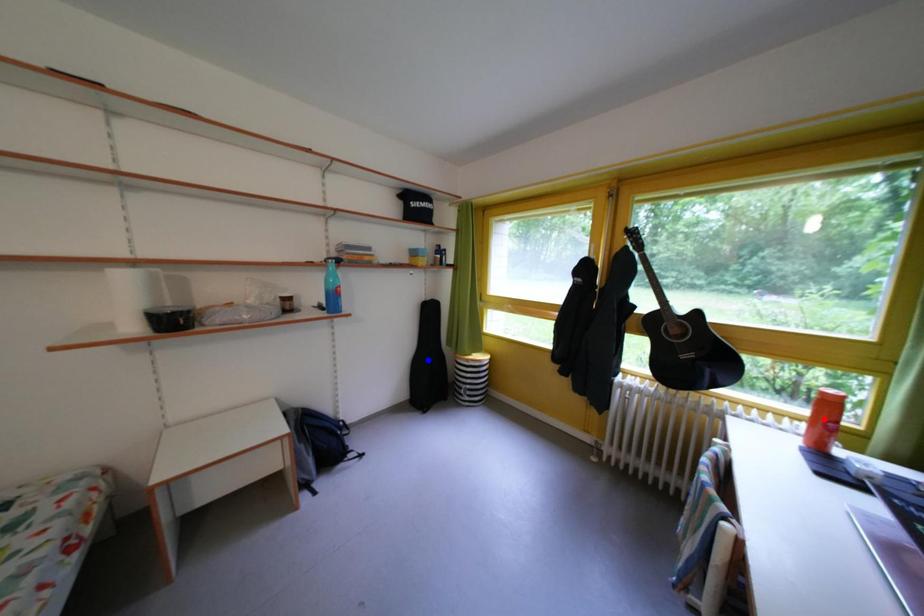
Question: Which of the two points in the image is closer to the camera?

Choices:
 (A) Blue point is closer.
 (B) Red point is closer.

Answer: (B)